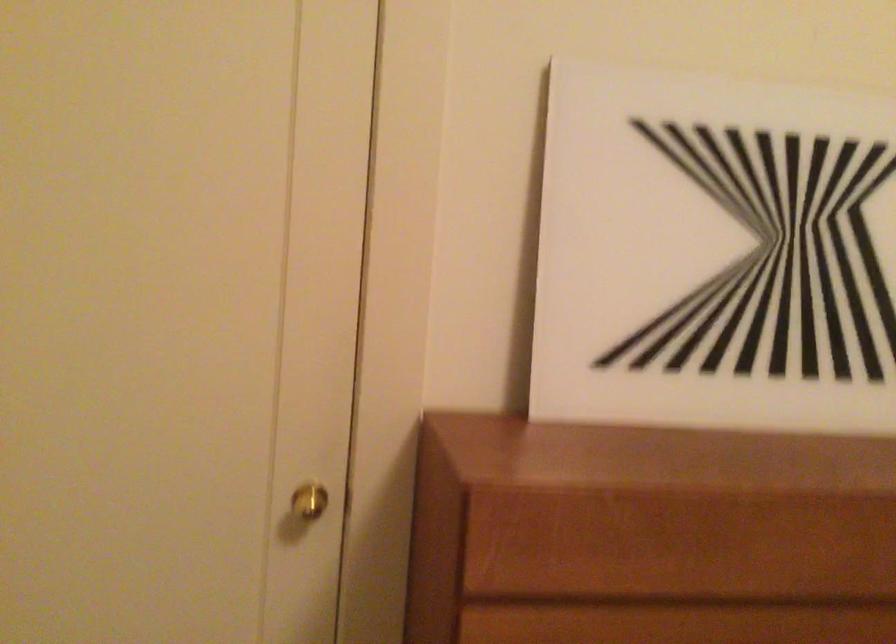
Describe the element at coordinates (308, 500) in the screenshot. This screenshot has width=896, height=644. I see `the brass door knob` at that location.